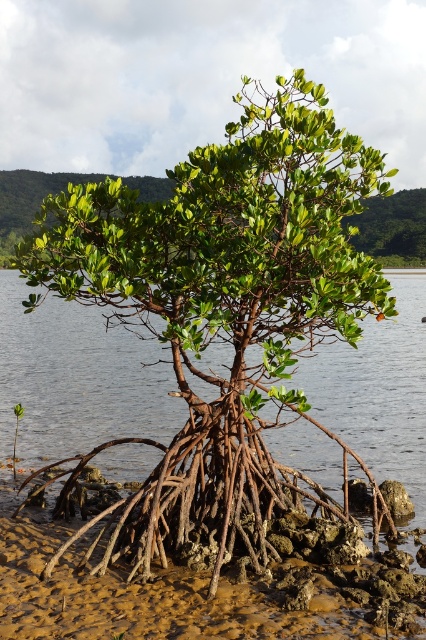
Does green matte tree at center have a smaller size compared to brown mud roots at center?

No.

Is point (235, 376) in front of point (359, 579)?

No, (235, 376) is further to viewer.

Describe the element at coordinates (224, 310) in the screenshot. The height and width of the screenshot is (640, 426). I see `green matte tree at center` at that location.

Identify the location of green matte tree at center. The image size is (426, 640). point(224,310).